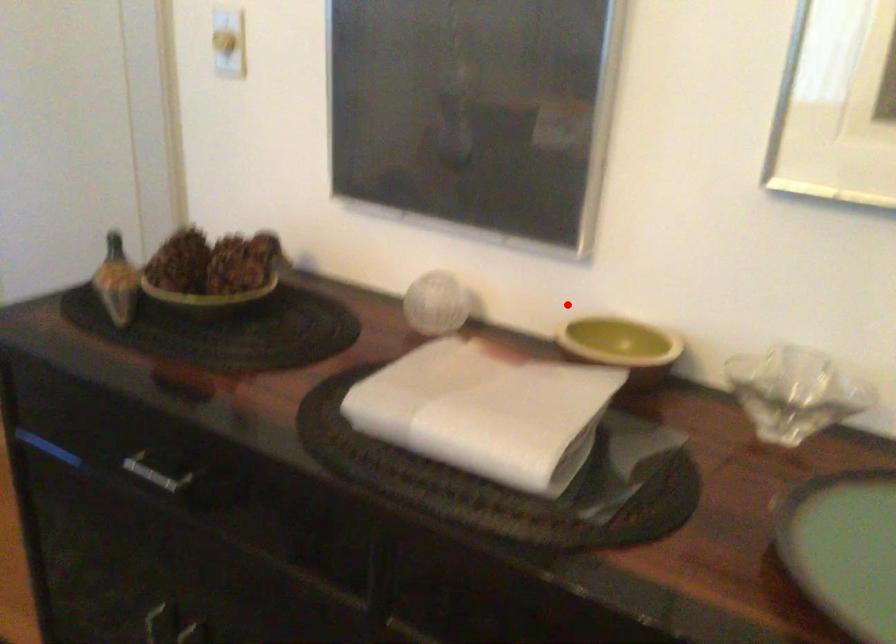
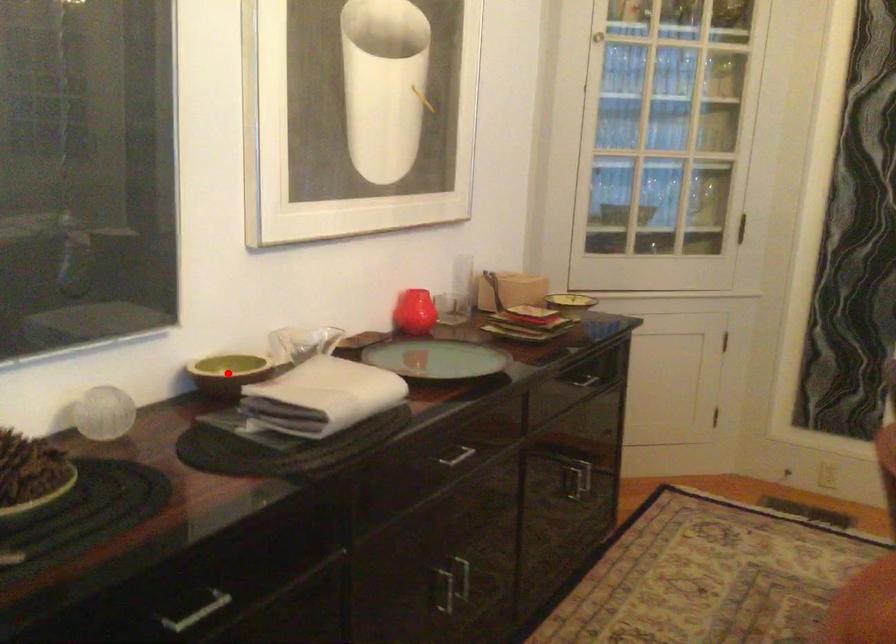
I am providing you with two images of the same scene from different viewpoints. A red point is marked on the first image and another point is marked on the second image. Are the points marked in image1 and image2 representing the same 3D position?

Yes